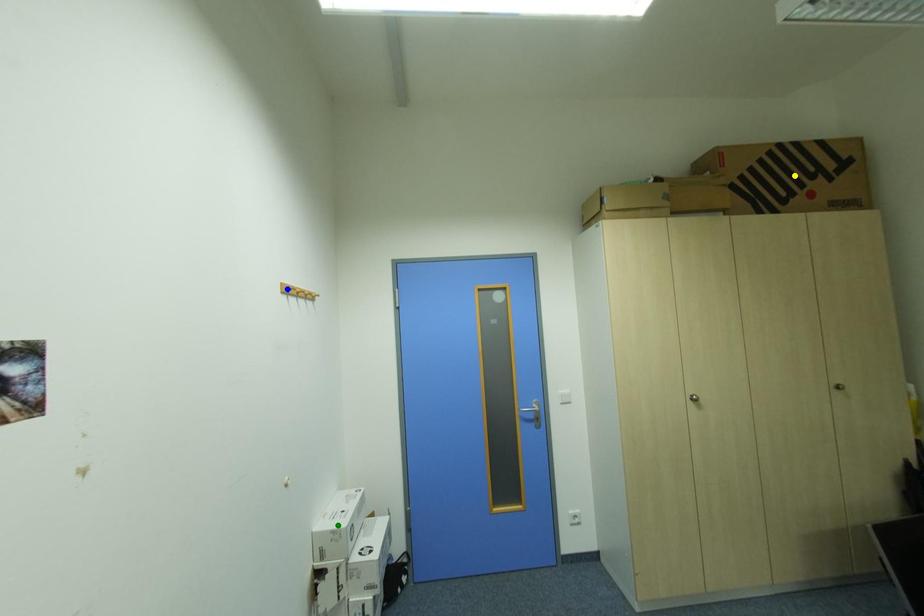
Order these from nearest to farthest:
A) yellow point
B) green point
C) blue point

yellow point < green point < blue point